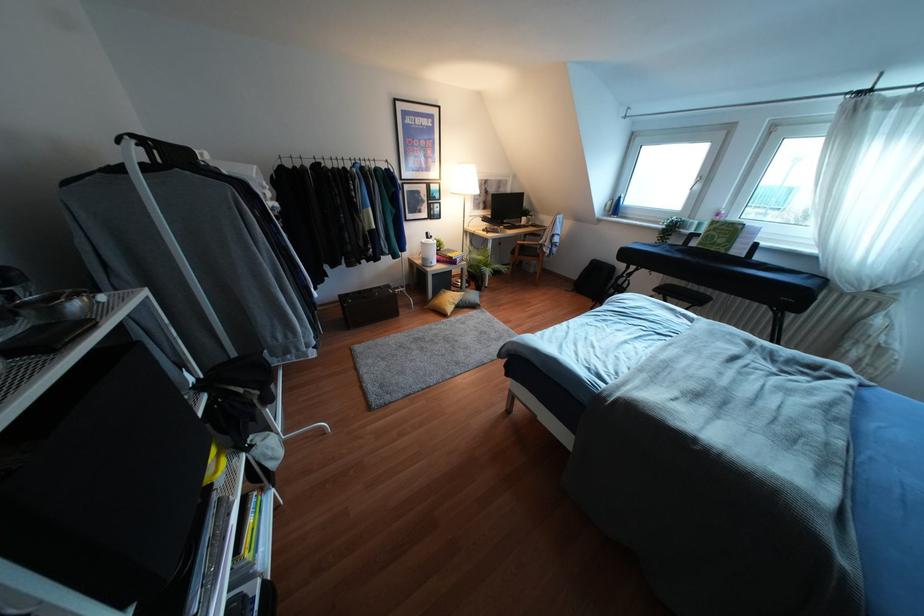
The height and width of the screenshot is (616, 924). What do you see at coordinates (697, 182) in the screenshot?
I see `the white window handle` at bounding box center [697, 182].